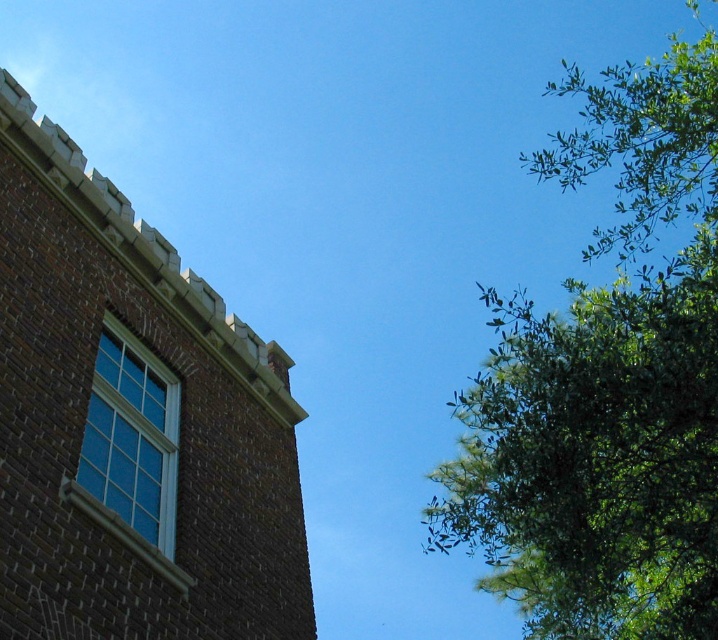
You are standing in front of a brick building and want to take a photo of the matte glass window at upper left without the green leafy tree at upper right blocking it. Based on their positions, is this possible?

The green leafy tree at upper right is closer to the viewer than the matte glass window at upper left, so the tree would block the window in the photo. To take a clear photo of the window, you would need to move to a position where the tree is not in front of the window.

Consider the image. You are standing in front of a brick building and looking at two points marked on the image. The first point is at coordinate point (x=689, y=64) and the second point is at coordinate point (x=123, y=436). Which point is closer to you?

Point (x=689, y=64) is further to the viewer than point (x=123, y=436), so the second point is closer to you.